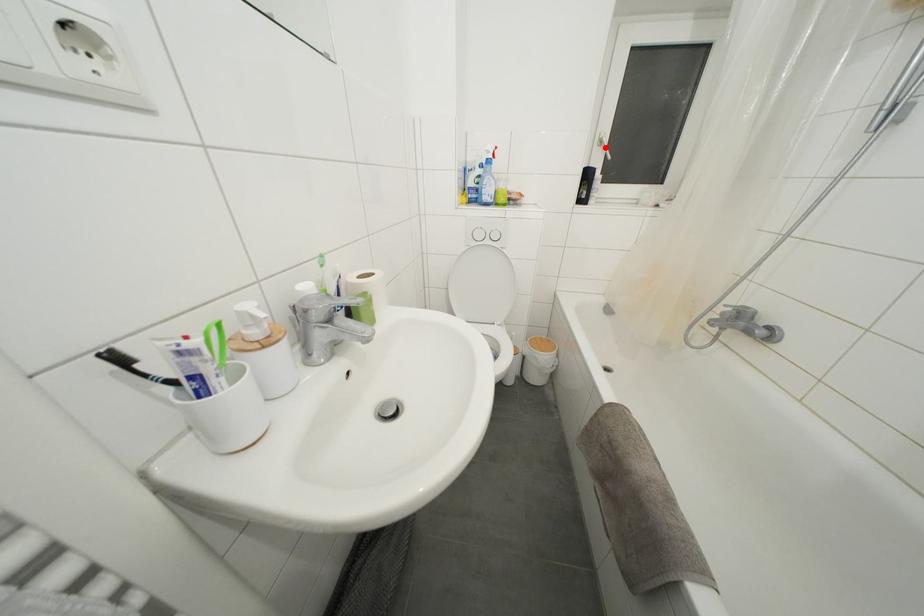
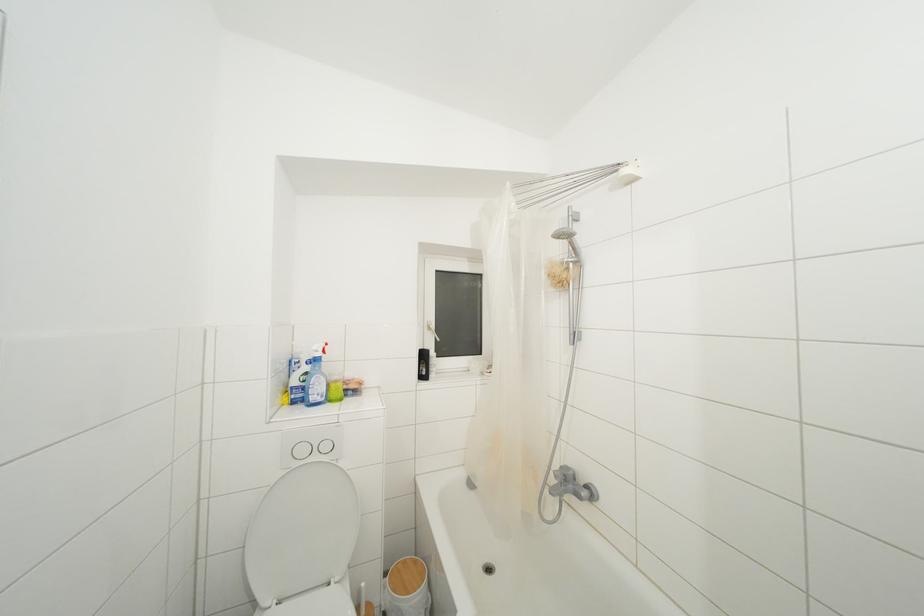
In the second image, find the point that corresponds to the highlighted location in the first image.

(433, 333)